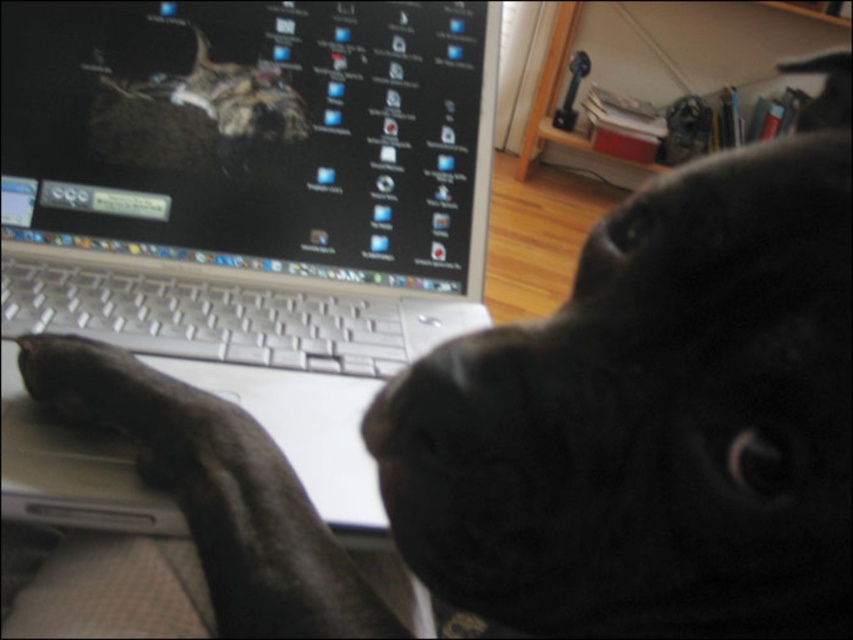
Consider the image. You are a photographer trying to capture the black dog in the scene. You want to ensure both the silver metallic laptop at center and the black matte nose at center are clearly visible in your shot. Based on their positions, which object should you focus on first to ensure both are in frame?

The silver metallic laptop at center is to the left of the black matte nose at center, so focusing on the black matte nose at center first will keep both objects within the frame since it is positioned further to the right.

You are trying to take a photo of the silver metallic laptop at center and the black matte nose at center. If the camera can only focus on objects wider than 10 cm, will both objects be in focus?

The silver metallic laptop at center might be wider than black matte nose at center, so the laptop is likely wider than 10 cm and would be in focus. However, the black matte nose at center is probably narrower than 10 cm, so it might not be in focus.

You are a photographer adjusting your camera to focus on two points in the scene. The first point is labeled as point (344, 236) and the second is point (415, 381). Which point should you focus on first if you want to ensure the closest object is in focus?

Point (344, 236) is further to the viewer than point (415, 381), so you should focus on point (344, 236) first to capture the closest object in focus.